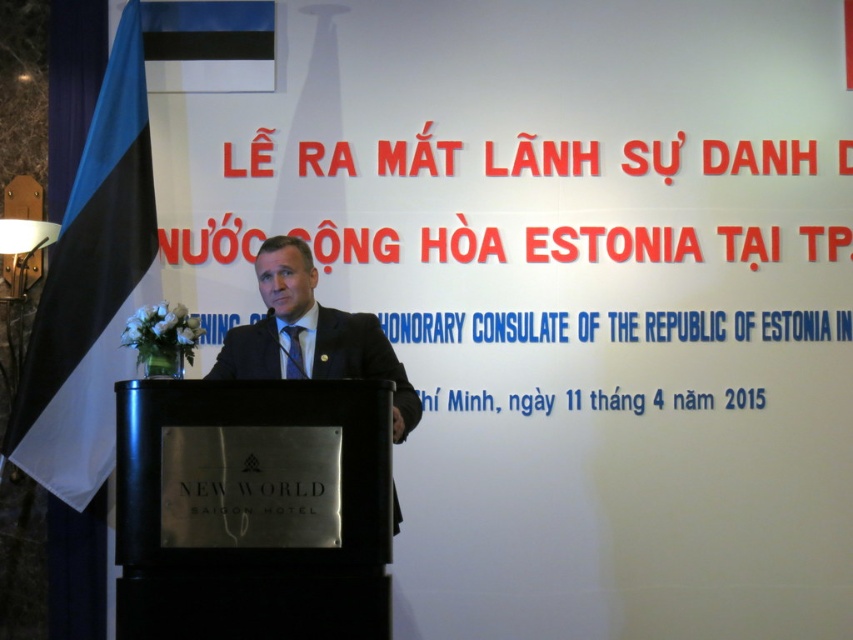
Question: Where is black polished wood podium at center located in relation to black suit at center in the image?

Choices:
 (A) left
 (B) right

Answer: (A)

Question: Which point is closer to the camera taking this photo?

Choices:
 (A) (244, 339)
 (B) (119, 330)
 (C) (357, 570)

Answer: (C)

Question: Can you confirm if black polished wood podium at center is thinner than black suit at center?

Choices:
 (A) yes
 (B) no

Answer: (B)

Question: Based on their relative distances, which object is farther from the black polished wood podium at center?

Choices:
 (A) black suit at center
 (B) blue-white flag at left

Answer: (B)

Question: Does black polished wood podium at center appear over blue-white flag at left?

Choices:
 (A) no
 (B) yes

Answer: (A)

Question: Which point is closer to the camera taking this photo?

Choices:
 (A) (389, 378)
 (B) (38, 400)

Answer: (A)